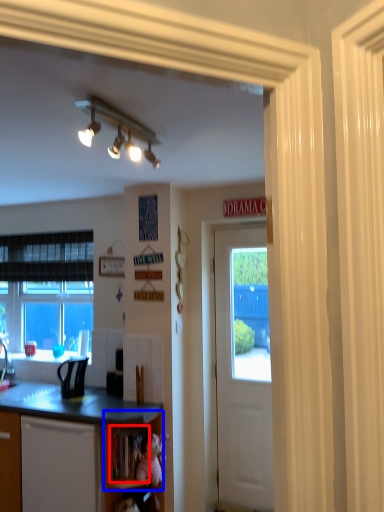
Question: Among these objects, which one is nearest to the camera, shelf (highlighted by a red box) or shelf (highlighted by a blue box)?

Choices:
 (A) shelf
 (B) shelf

Answer: (B)